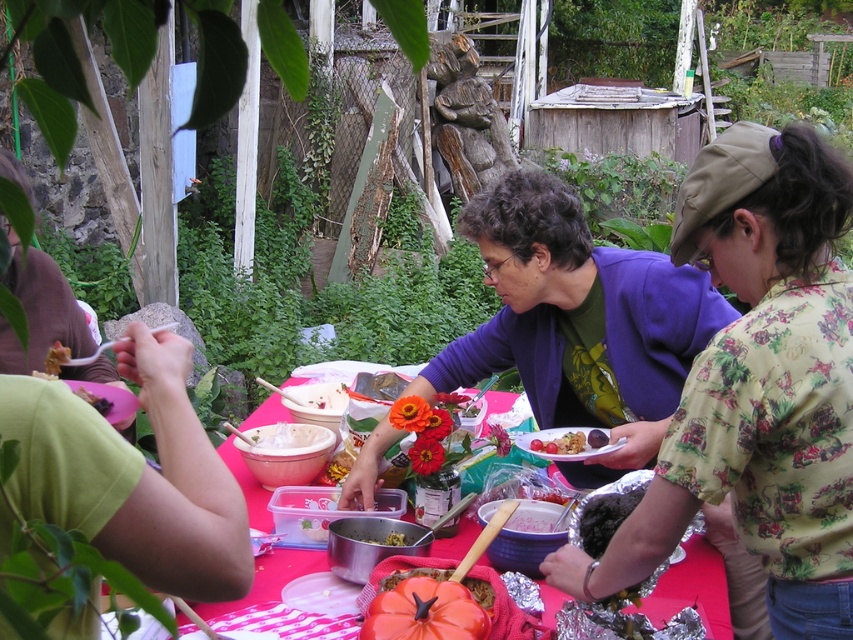
Does red plastic table at center come behind smooth chocolate cake at center?

No, red plastic table at center is in front of smooth chocolate cake at center.

Between red plastic table at center and smooth chocolate cake at center, which one has more height?

With more height is red plastic table at center.

Is point (256, 563) more distant than point (602, 433)?

No, it is not.

Locate an element on the screen. red plastic table at center is located at coordinates (699, 584).

Is floral cotton shirt at center closer to camera compared to smooth chocolate cake at center?

Yes, it is in front of smooth chocolate cake at center.

Where is `floral cotton shirt at center`? floral cotton shirt at center is located at coordinates (757, 387).

Find the location of a particular element. The image size is (853, 640). floral cotton shirt at center is located at coordinates (757, 387).

Does floral cotton shirt at center have a greater height compared to golden brown crumbly at center?

Indeed, floral cotton shirt at center has a greater height compared to golden brown crumbly at center.

Can you confirm if floral cotton shirt at center is positioned to the right of golden brown crumbly at center?

Yes, floral cotton shirt at center is to the right of golden brown crumbly at center.

Who is more forward, (x=817, y=532) or (x=578, y=449)?

Point (x=817, y=532) is in front.

Find the location of a particular element. floral cotton shirt at center is located at coordinates (757, 387).